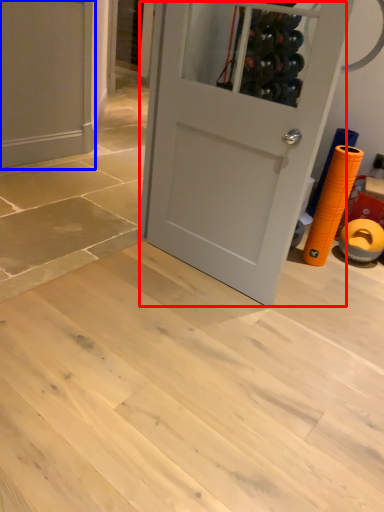
Question: Which object is closer to the camera taking this photo, door (highlighted by a red box) or door (highlighted by a blue box)?

Choices:
 (A) door
 (B) door

Answer: (A)